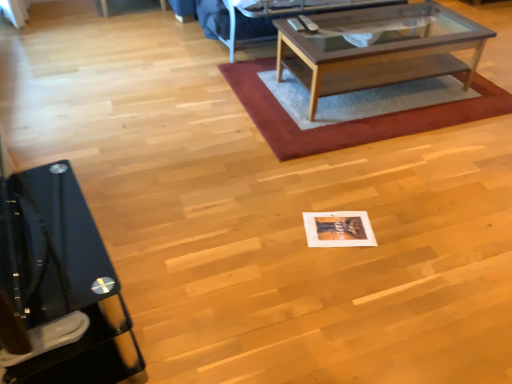
The image size is (512, 384). Identify the location of free space to the back side of black glossy desk at left. (140, 226).